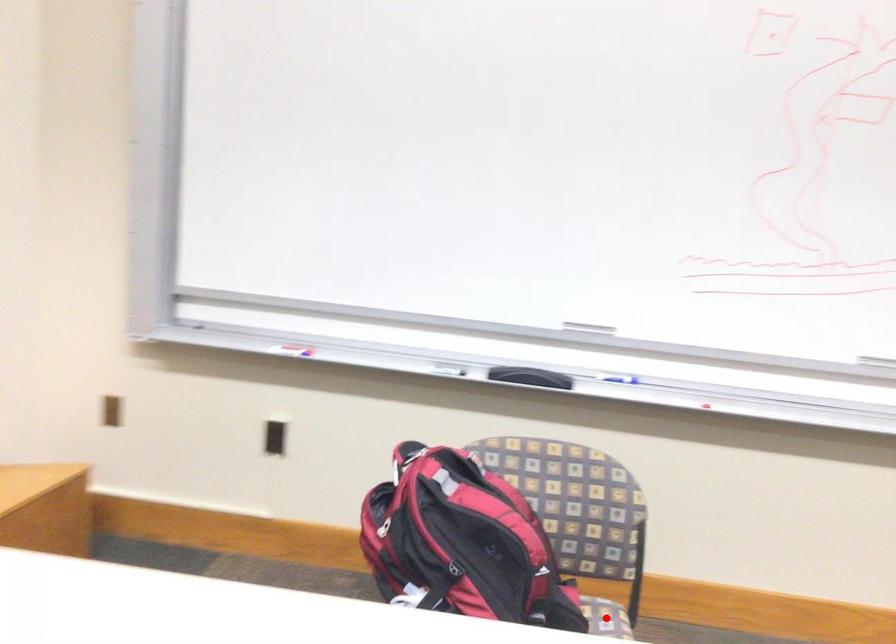
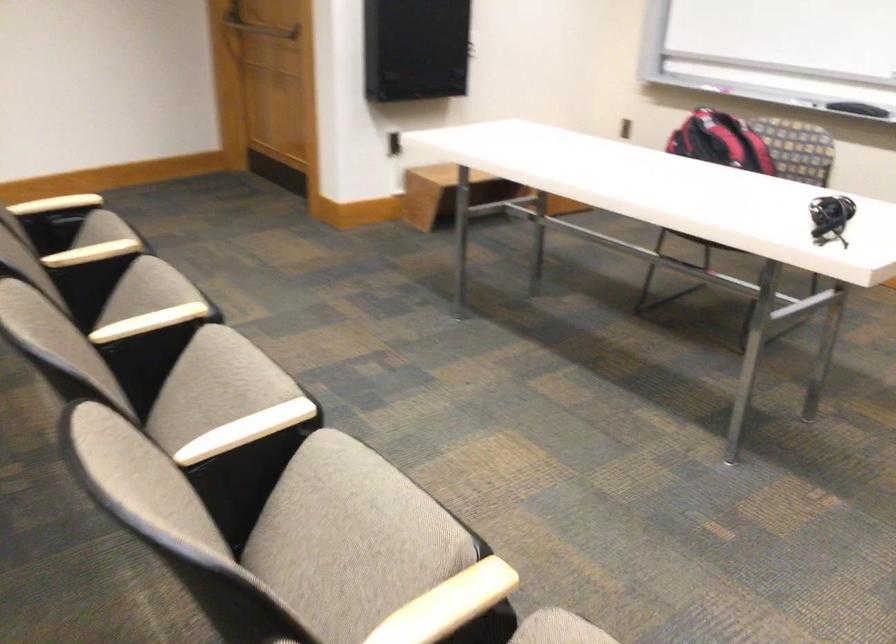
Question: I am providing you with two images of the same scene from different viewpoints. A red point is marked on the first image. At the location where the point appears in image 1, is it still visible in image 2?

Choices:
 (A) Yes
 (B) No

Answer: (B)